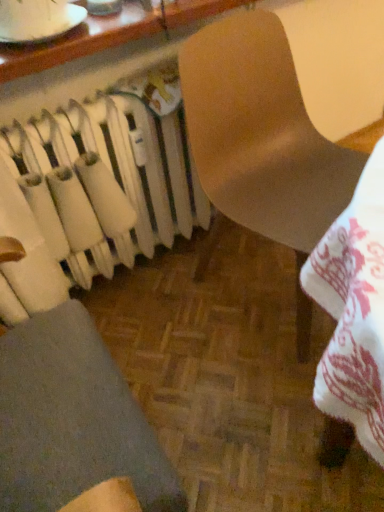
Find the location of a particular element. vacant area that lies in front of matte brown chair at center is located at coordinates (259, 418).